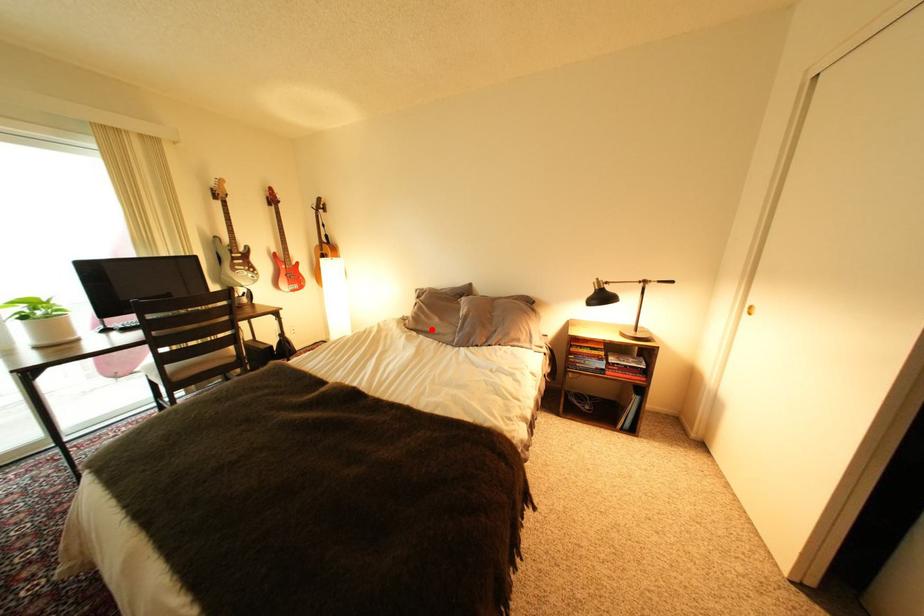
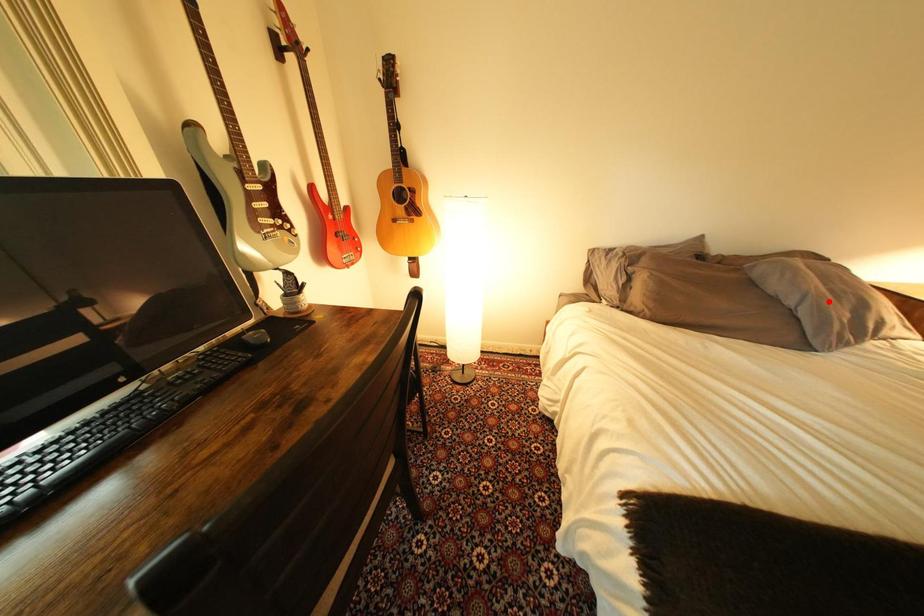
I am providing you with two images of the same scene from different viewpoints. A red point is marked on the first image and another point is marked on the second image. Is the red point in image1 aligned with the point shown in image2?

No